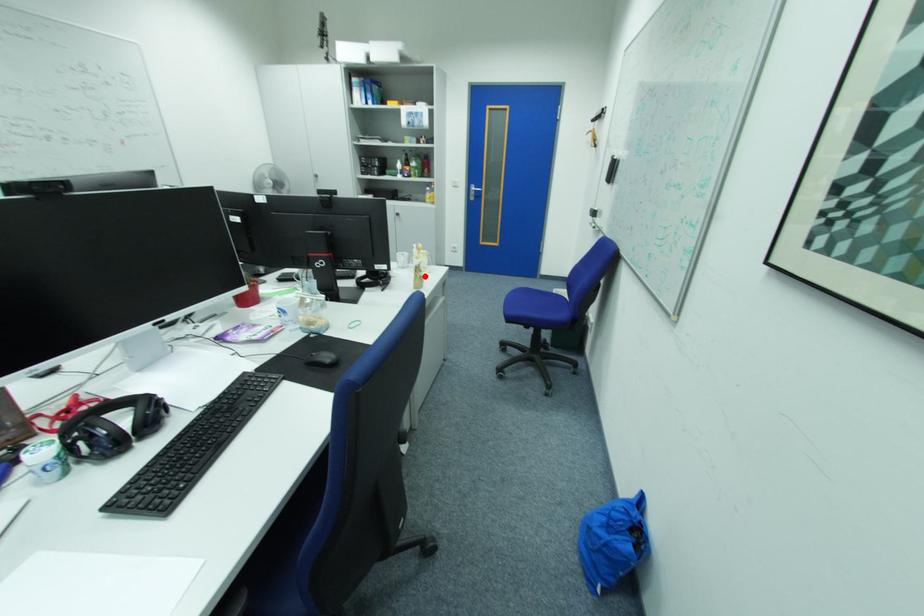
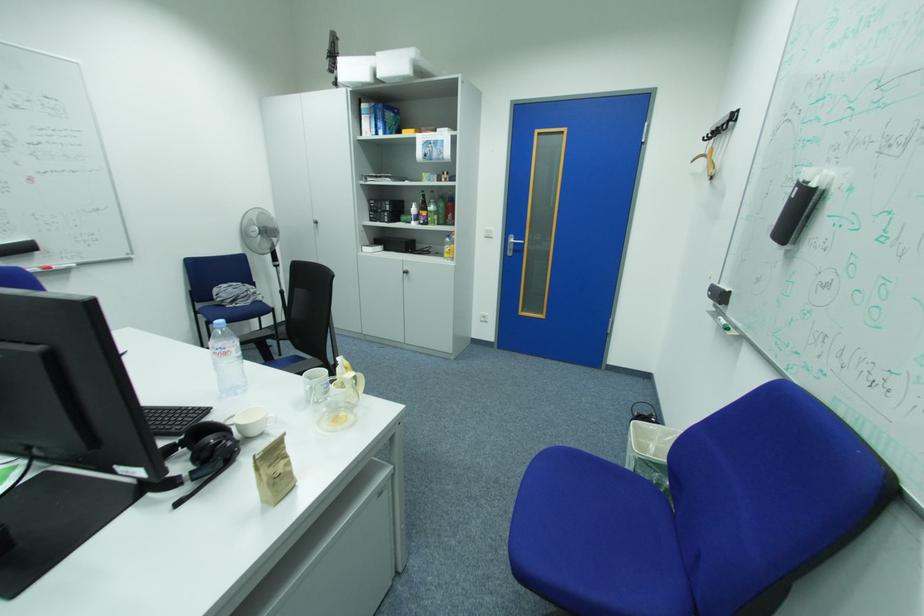
Find the pixel in the second image that matches the highlighted location in the first image.

(268, 476)